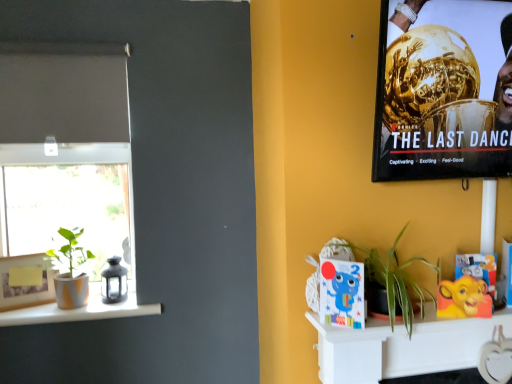
Question: Is green matte plant at left, which is the 1th houseplant from left to right, situated inside white matte shelf at lower right or outside?

Choices:
 (A) inside
 (B) outside

Answer: (B)

Question: From their relative heights in the image, would you say green matte plant at left, which is the 1th houseplant from left to right, is taller or shorter than white matte shelf at lower right?

Choices:
 (A) short
 (B) tall

Answer: (B)

Question: Based on their relative distances, which object is farther from the matte orange vase at left?

Choices:
 (A) metallic gold trophy at upper right
 (B) cartoon blue elephant at center
 (C) green matte plant at left, which is the 1th houseplant from left to right
 (D) green leafy plant at center-right, which is the first houseplant in right-to-left order
 (E) white matte shelf at lower right

Answer: (A)

Question: Estimate the real-world distances between objects in this image. Which object is farther from the green leafy plant at center-right, which is the first houseplant in right-to-left order?

Choices:
 (A) matte orange vase at left
 (B) white matte shelf at lower right
 (C) cartoon blue elephant at center
 (D) metallic gold trophy at upper right
 (E) green matte plant at left, which appears as the 2th houseplant when viewed from the front

Answer: (E)